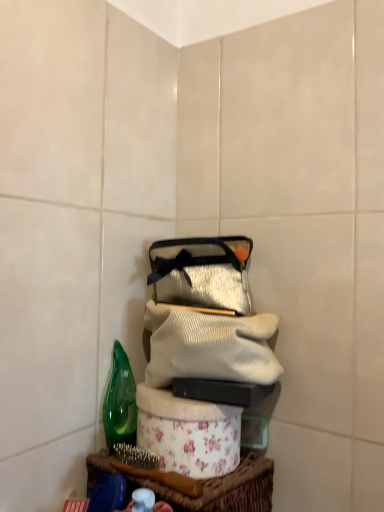
At what (x,y) coordinates should I click in order to perform the action: click on free space above white ribbed sweater at center (from a real-world perspective). Please return your answer as a coordinate pair (x, y). Looking at the image, I should click on (200, 306).